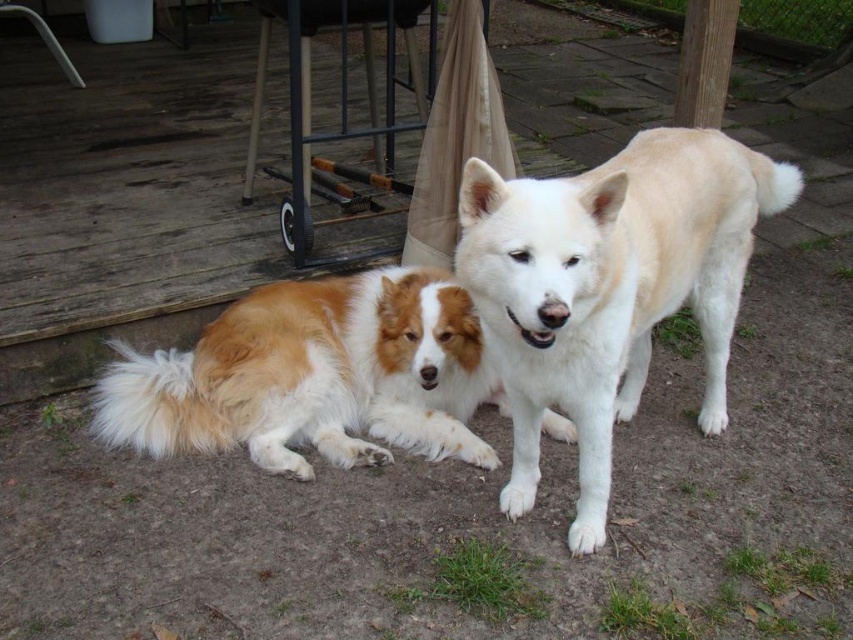
You are standing at the origin point of the coordinate system where the image is captured. You want to walk towards the white fur dog at center. Which direction should you move in relation to the point at coordinate point (608, 288)?

The point at coordinate (608, 288) corresponds to the white fur dog at center, so you should move towards that coordinate point to reach the dog.